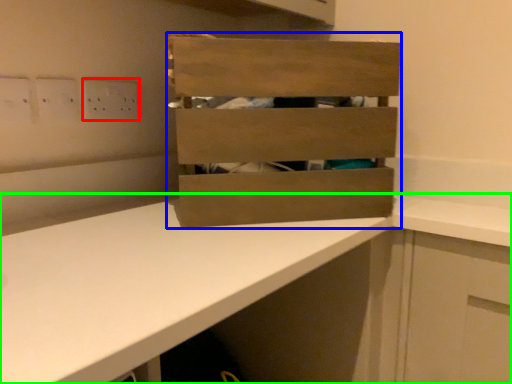
Question: Which object is positioned closest to electric outlet (highlighted by a red box)? Select from crate (highlighted by a blue box) and countertop (highlighted by a green box).

Choices:
 (A) crate
 (B) countertop

Answer: (A)